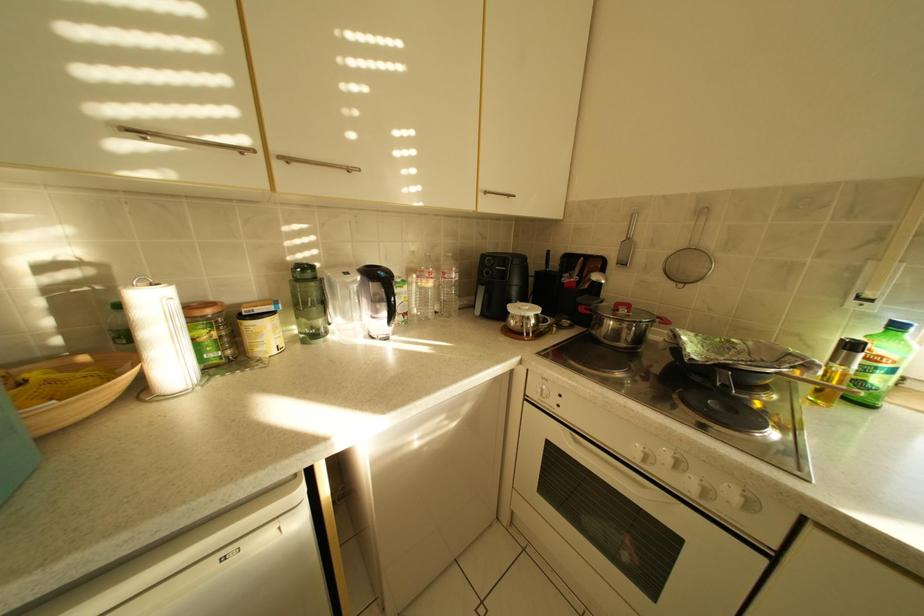
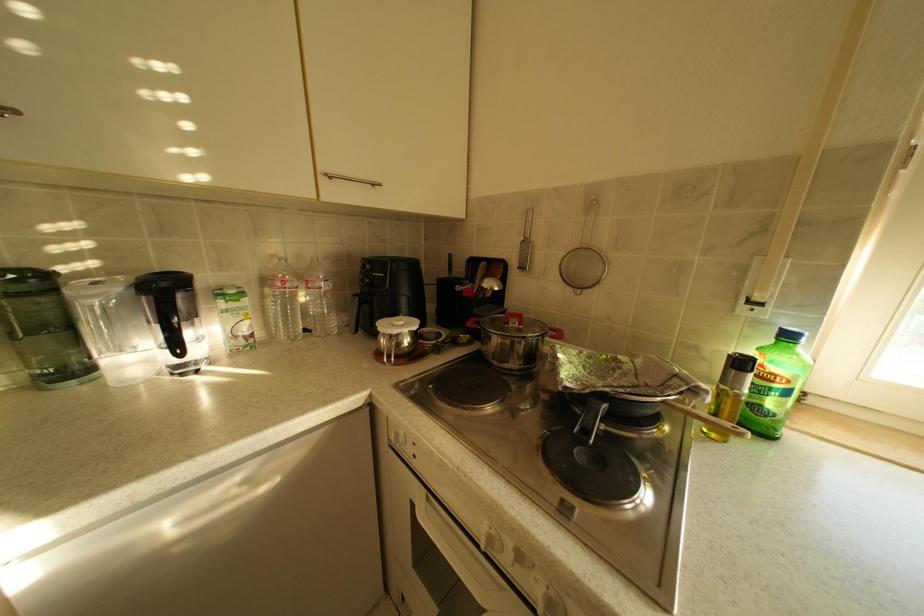
Question: The first image is from the beginning of the video and the second image is from the end. How did the camera likely rotate when shooting the video?

Choices:
 (A) Left
 (B) Right
 (C) Up
 (D) Down

Answer: (B)